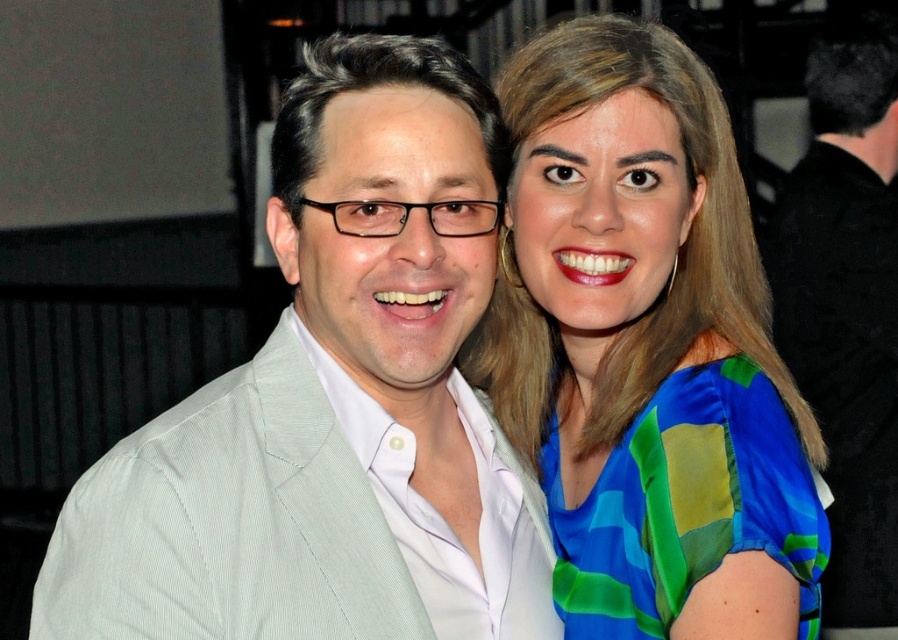
Question: Considering the real-world distances, which object is farthest from the silky blue-green blouse at upper right?

Choices:
 (A) light gray suit at center
 (B) black matte suit at right

Answer: (B)

Question: Can you confirm if light gray suit at center is positioned below silky blue-green blouse at upper right?

Choices:
 (A) yes
 (B) no

Answer: (A)

Question: In this image, where is black matte suit at right located relative to blue silk dress at upper right?

Choices:
 (A) left
 (B) right

Answer: (B)

Question: Among these objects, which one is farthest from the camera?

Choices:
 (A) blue silk dress at upper right
 (B) silky blue-green blouse at upper right
 (C) black matte suit at right
 (D) light gray suit at center

Answer: (C)

Question: Which point appears farthest from the camera in this image?

Choices:
 (A) (797, 470)
 (B) (808, 76)

Answer: (B)

Question: Is light gray suit at center above silky blue-green blouse at upper right?

Choices:
 (A) no
 (B) yes

Answer: (A)